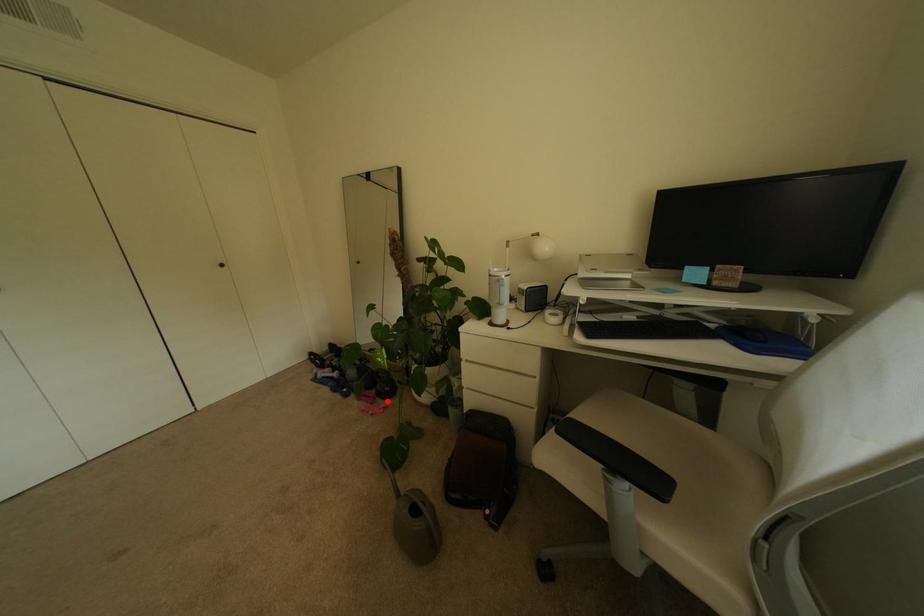
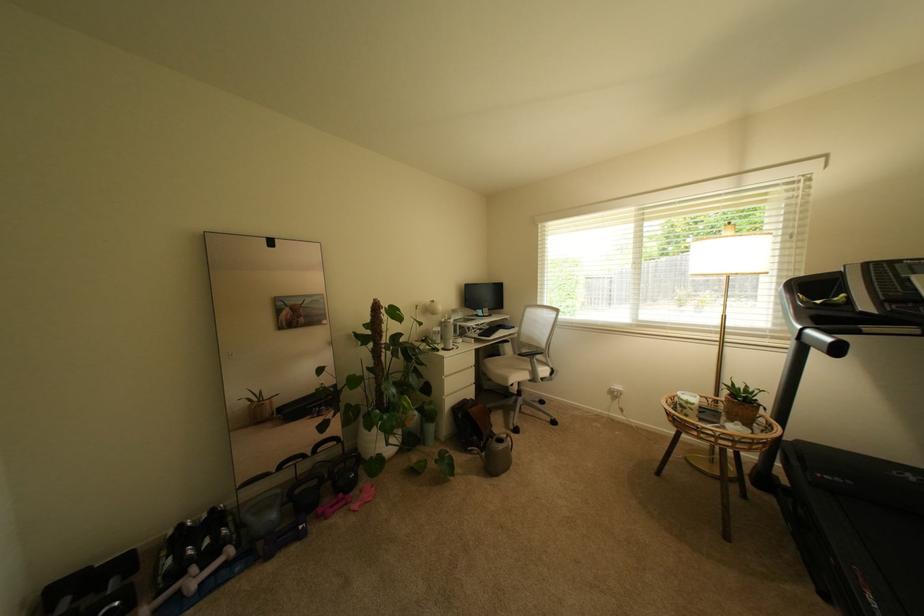
The point at the highlighted location is marked in the first image. Where is the corresponding point in the second image?

(359, 495)